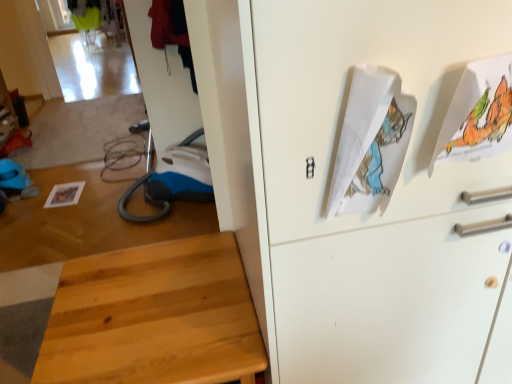
What do you see at coordinates (478, 114) in the screenshot? Image resolution: width=512 pixels, height=384 pixels. I see `white paper with colorful illustration at upper right, the 1th wrapping paper viewed from the right` at bounding box center [478, 114].

Measure the distance between point [110,285] and camera.

They are 4.43 feet apart.

Identify the location of light wood stool at lower left. (154, 317).

The height and width of the screenshot is (384, 512). Find the location of `white paper at upper right, which is counted as the second wrapping paper, starting from the right`. white paper at upper right, which is counted as the second wrapping paper, starting from the right is located at coordinates (371, 142).

Where is `white paper with colorful illustration at upper right, which is the second wrapping paper from left to right`? This screenshot has width=512, height=384. white paper with colorful illustration at upper right, which is the second wrapping paper from left to right is located at coordinates (478, 114).

Considering the points (242, 367) and (364, 121), which point is behind, point (242, 367) or point (364, 121)?

The point (242, 367) is behind.

Is light wood stool at lower left oriented towards white paper at upper right, the 1th wrapping paper viewed from the left?

No.

Considering the sizes of light wood stool at lower left and white paper at upper right, the 1th wrapping paper viewed from the left, in the image, is light wood stool at lower left wider or thinner than white paper at upper right, the 1th wrapping paper viewed from the left,?

Clearly, light wood stool at lower left has more width compared to white paper at upper right, the 1th wrapping paper viewed from the left.

From a real-world perspective, who is located lower, light wood stool at lower left or white paper at upper right, which is counted as the second wrapping paper, starting from the right?

From a 3D spatial view, light wood stool at lower left is below.

Considering the sizes of white paper with colorful illustration at upper right, the 1th wrapping paper viewed from the right, and light wood stool at lower left in the image, is white paper with colorful illustration at upper right, the 1th wrapping paper viewed from the right, taller or shorter than light wood stool at lower left?

white paper with colorful illustration at upper right, the 1th wrapping paper viewed from the right, is shorter than light wood stool at lower left.

Looking at this image, how different are the orientations of white paper with colorful illustration at upper right, the 1th wrapping paper viewed from the right, and light wood stool at lower left in degrees?

The facing directions of white paper with colorful illustration at upper right, the 1th wrapping paper viewed from the right, and light wood stool at lower left are 90.2 degrees apart.

Is white paper with colorful illustration at upper right, which is the second wrapping paper from left to right, facing towards light wood stool at lower left?

No, white paper with colorful illustration at upper right, which is the second wrapping paper from left to right, does not turn towards light wood stool at lower left.

Looking at this image, from the image's perspective, is white paper with colorful illustration at upper right, the 1th wrapping paper viewed from the right, beneath light wood stool at lower left?

No.

Based on their sizes in the image, would you say white paper at upper right, the 1th wrapping paper viewed from the left, is bigger or smaller than white paper with colorful illustration at upper right, which is the second wrapping paper from left to right?

In the image, white paper at upper right, the 1th wrapping paper viewed from the left, appears to be larger than white paper with colorful illustration at upper right, which is the second wrapping paper from left to right.

Is white paper at upper right, the 1th wrapping paper viewed from the left, positioned beyond the bounds of white paper with colorful illustration at upper right, which is the second wrapping paper from left to right?

white paper at upper right, the 1th wrapping paper viewed from the left, lies outside white paper with colorful illustration at upper right, which is the second wrapping paper from left to right,'s area.

Looking at their sizes, would you say white paper at upper right, which is counted as the second wrapping paper, starting from the right, is wider or thinner than white paper with colorful illustration at upper right, the 1th wrapping paper viewed from the right?

white paper at upper right, which is counted as the second wrapping paper, starting from the right, is thinner than white paper with colorful illustration at upper right, the 1th wrapping paper viewed from the right.

Between point (336, 174) and point (439, 153), which one is positioned behind?

Positioned behind is point (439, 153).

Does light wood stool at lower left have a smaller size compared to white paper with colorful illustration at upper right, which is the second wrapping paper from left to right?

No.

Identify the location of furniture below the white paper with colorful illustration at upper right, the 1th wrapping paper viewed from the right (from the image's perspective). This screenshot has height=384, width=512. (154, 317).

What's the angular difference between light wood stool at lower left and white paper with colorful illustration at upper right, which is the second wrapping paper from left to right,'s facing directions?

90.2 degrees.

Is light wood stool at lower left wider than white paper with colorful illustration at upper right, the 1th wrapping paper viewed from the right?

Indeed, light wood stool at lower left has a greater width compared to white paper with colorful illustration at upper right, the 1th wrapping paper viewed from the right.

Is white paper at upper right, which is counted as the second wrapping paper, starting from the right, facing towards light wood stool at lower left?

No, white paper at upper right, which is counted as the second wrapping paper, starting from the right, does not turn towards light wood stool at lower left.

How far apart are white paper at upper right, which is counted as the second wrapping paper, starting from the right, and light wood stool at lower left?

white paper at upper right, which is counted as the second wrapping paper, starting from the right, is 26.98 inches from light wood stool at lower left.

Does point (394, 157) appear closer or farther from the camera than point (136, 268)?

Point (394, 157) is closer to the camera than point (136, 268).

Based on the photo, who is shorter, white paper at upper right, which is counted as the second wrapping paper, starting from the right, or light wood stool at lower left?

white paper at upper right, which is counted as the second wrapping paper, starting from the right.

Is white paper with colorful illustration at upper right, the 1th wrapping paper viewed from the right, positioned with its back to white paper at upper right, the 1th wrapping paper viewed from the left?

white paper with colorful illustration at upper right, the 1th wrapping paper viewed from the right, does not have its back to white paper at upper right, the 1th wrapping paper viewed from the left.

Is point (508, 132) closer or farther from the camera than point (358, 146)?

Point (508, 132) is farther from the camera than point (358, 146).

Considering the sizes of white paper with colorful illustration at upper right, the 1th wrapping paper viewed from the right, and white paper at upper right, the 1th wrapping paper viewed from the left, in the image, is white paper with colorful illustration at upper right, the 1th wrapping paper viewed from the right, bigger or smaller than white paper at upper right, the 1th wrapping paper viewed from the left,?

white paper with colorful illustration at upper right, the 1th wrapping paper viewed from the right, is smaller than white paper at upper right, the 1th wrapping paper viewed from the left.

Consider the image. Is white paper with colorful illustration at upper right, the 1th wrapping paper viewed from the right, positioned behind white paper at upper right, the 1th wrapping paper viewed from the left?

Yes, the depth of white paper with colorful illustration at upper right, the 1th wrapping paper viewed from the right, is greater than that of white paper at upper right, the 1th wrapping paper viewed from the left.

At what (x,y) coordinates should I click in order to perform the action: click on furniture below the white paper at upper right, the 1th wrapping paper viewed from the left (from the image's perspective). Please return your answer as a coordinate pair (x, y). Looking at the image, I should click on (154, 317).

Find the location of `furniture on the left of white paper with colorful illustration at upper right, the 1th wrapping paper viewed from the right`. furniture on the left of white paper with colorful illustration at upper right, the 1th wrapping paper viewed from the right is located at coordinates (154, 317).

Estimate the real-world distances between objects in this image. Which object is closer to light wood stool at lower left, white paper with colorful illustration at upper right, which is the second wrapping paper from left to right, or white paper at upper right, the 1th wrapping paper viewed from the left?

The object closer to light wood stool at lower left is white paper at upper right, the 1th wrapping paper viewed from the left.

Which object lies further to the anchor point white paper with colorful illustration at upper right, the 1th wrapping paper viewed from the right, light wood stool at lower left or white paper at upper right, which is counted as the second wrapping paper, starting from the right?

Based on the image, light wood stool at lower left appears to be further to white paper with colorful illustration at upper right, the 1th wrapping paper viewed from the right.

When comparing their distances from white paper at upper right, which is counted as the second wrapping paper, starting from the right, does white paper with colorful illustration at upper right, which is the second wrapping paper from left to right, or light wood stool at lower left seem further?

light wood stool at lower left lies further to white paper at upper right, which is counted as the second wrapping paper, starting from the right, than the other object.

When comparing their distances from white paper at upper right, the 1th wrapping paper viewed from the left, does light wood stool at lower left or white paper with colorful illustration at upper right, which is the second wrapping paper from left to right, seem closer?

white paper with colorful illustration at upper right, which is the second wrapping paper from left to right.

Which object lies further to the anchor point light wood stool at lower left, white paper at upper right, the 1th wrapping paper viewed from the left, or white paper with colorful illustration at upper right, the 1th wrapping paper viewed from the right?

white paper with colorful illustration at upper right, the 1th wrapping paper viewed from the right.

Estimate the real-world distances between objects in this image. Which object is further from white paper with colorful illustration at upper right, the 1th wrapping paper viewed from the right, white paper at upper right, which is counted as the second wrapping paper, starting from the right, or light wood stool at lower left?

The object further to white paper with colorful illustration at upper right, the 1th wrapping paper viewed from the right, is light wood stool at lower left.

This screenshot has height=384, width=512. I want to click on wrapping paper located between light wood stool at lower left and white paper with colorful illustration at upper right, the 1th wrapping paper viewed from the right, in the left-right direction, so click(x=371, y=142).